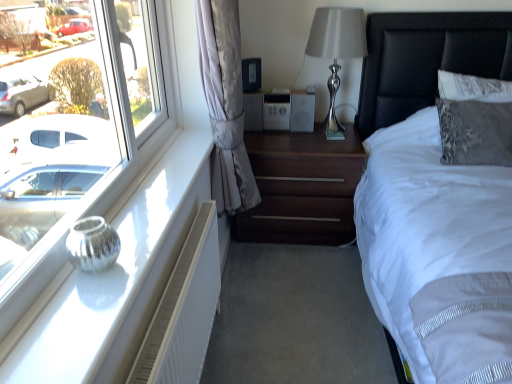
You are a GUI agent. You are given a task and a screenshot of the screen. Output one action in this format:
    pyautogui.click(x=<x>, y=<y>)
    Task: Click on the free point below satin fabric curtain at lower left (from a real-world perspective)
    This screenshot has height=384, width=512.
    Given the screenshot: What is the action you would take?
    pyautogui.click(x=244, y=284)